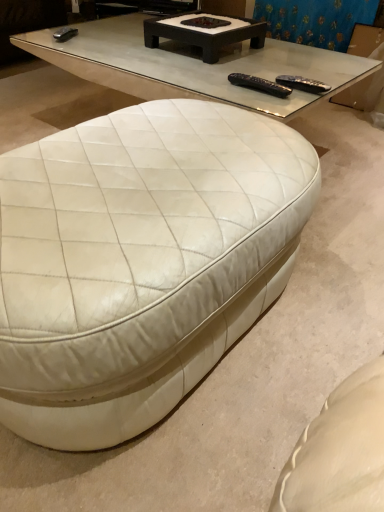
Question: Visually, is black plastic remote at upper center, arranged as the second remote when viewed from the right, positioned to the left or to the right of white leather ottoman at lower left, the 1th coffee table in the front-to-back sequence?

Choices:
 (A) right
 (B) left

Answer: (A)

Question: From a real-world perspective, is black plastic remote at upper center, the 1th remote viewed from the left, positioned above or below white leather ottoman at lower left, the 1th coffee table in the front-to-back sequence?

Choices:
 (A) above
 (B) below

Answer: (A)

Question: Which of these objects is positioned closest to the black plastic remote at upper center, arranged as the second remote when viewed from the right?

Choices:
 (A) blue fabric curtain at upper center
 (B) black plastic remote at upper right, which appears as the 2th remote when viewed from the left
 (C) dark brown wood coffee table at upper center, the 1th coffee table when ordered from back to front
 (D) white leather ottoman at lower left, placed as the 2th coffee table when sorted from back to front

Answer: (B)

Question: Estimate the real-world distances between objects in this image. Which object is closer to the blue fabric curtain at upper center?

Choices:
 (A) black plastic remote at upper center, the 1th remote viewed from the left
 (B) black plastic remote at upper right, the 1th remote from the right
 (C) dark brown wood coffee table at upper center, the 1th coffee table when ordered from back to front
 (D) white leather ottoman at lower left, the 1th coffee table in the front-to-back sequence

Answer: (C)